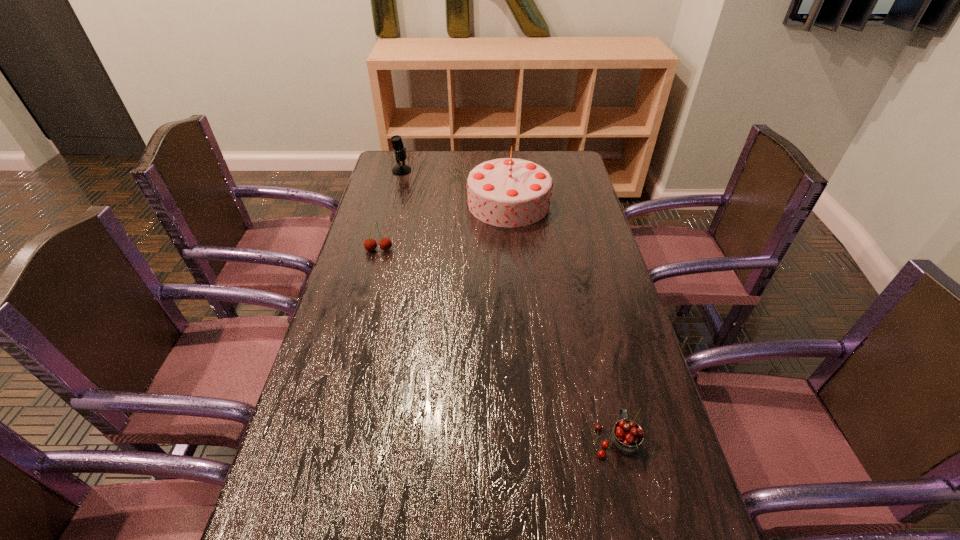
In order to click on vacant space at the far edge in this screenshot , I will do (x=468, y=173).

Locate an element on the screen. Image resolution: width=960 pixels, height=540 pixels. vacant position at the left edge of the desktop is located at coordinates (327, 330).

This screenshot has height=540, width=960. In order to click on vacant space at the right edge of the desktop in this screenshot , I will do [x=666, y=514].

Locate an element on the screen. Image resolution: width=960 pixels, height=540 pixels. vacant position at the far left corner of the desktop is located at coordinates (378, 177).

I want to click on vacant point at the far right corner, so click(554, 174).

I want to click on free space between the third farthest object and the microphone, so click(390, 210).

Locate an element on the screen. vacant region between the second farthest object and the nearest object is located at coordinates (563, 321).

The image size is (960, 540). Find the location of `vacant area that lies between the birthday cake and the third farthest object`. vacant area that lies between the birthday cake and the third farthest object is located at coordinates (444, 227).

I want to click on empty location between the taller cherry and the birthday cake, so click(x=444, y=227).

Identify the location of vacant space in between the taller cherry and the shortest object. Image resolution: width=960 pixels, height=540 pixels. (497, 345).